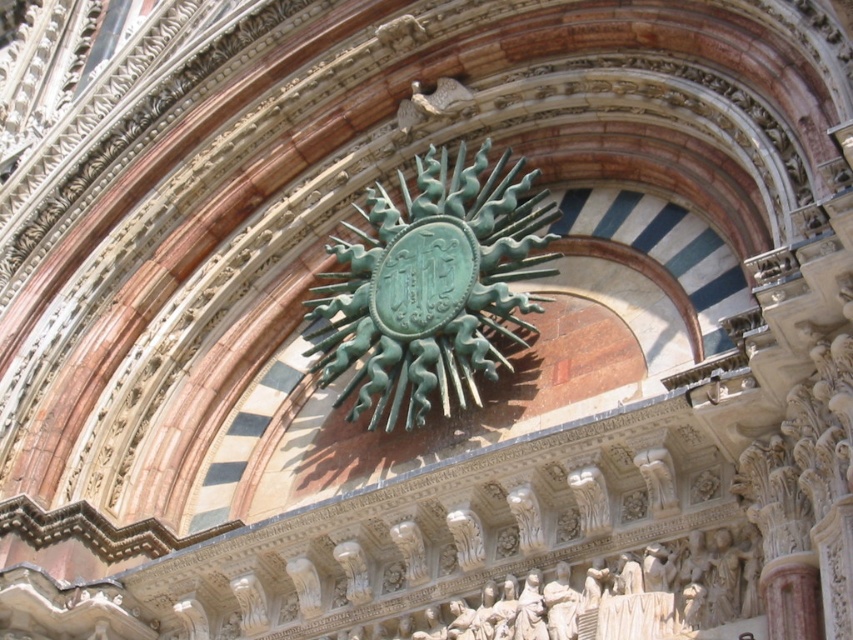
You are an architect examining the facade. You need to determine if the green patina metal sunburst at center can be placed in a space reserved for the white marble statue at lower center. Based on their sizes, will it fit?

The green patina metal sunburst at center is larger in width than the white marble statue at lower center, so it will not fit in the space reserved for the white marble statue at lower center.

You are an architect examining the facade and need to determine the position of the green patina metal sunburst at center. What are its coordinates relative to the image?

The green patina metal sunburst at center is located at coordinates point (431, 285).

Looking at this image, you are an art conservator examining the facade. You need to clean both the green patina metal sunburst at center and the green patina eagle at upper center. Which object should you start with if you want to work from the closest to the farthest?

You should start with the green patina metal sunburst at center because it is closer to the viewer than the green patina eagle at upper center.